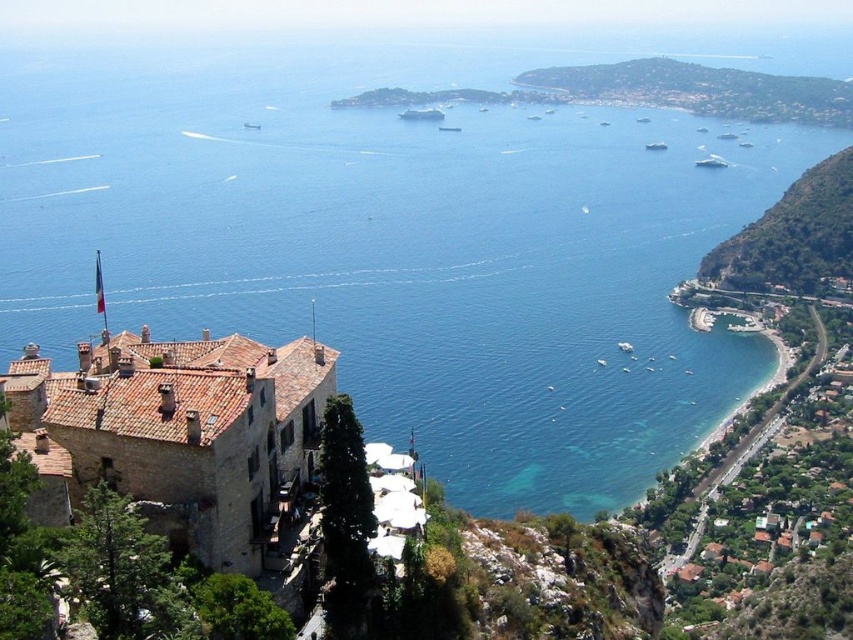
You are standing at the point labeled as point (792, 236) in the image. What do you see in front of you?

You see a green leafy hillside at right in front of you.

From the picture: You are a photographer planning to capture a sunset shot. You have a wide angle lens that can cover a 120 degree field of view. You are standing at the top of the green leafy hillside at right and want to include both the hillside and the metallic silver boat at center in your shot. Can your lens accommodate both in the frame?

The green leafy hillside at right is positioned on the left side of metallic silver boat at center, so the distance between them is within the 120 degree field of view of your wide angle lens. Yes, your lens can accommodate both in the frame.